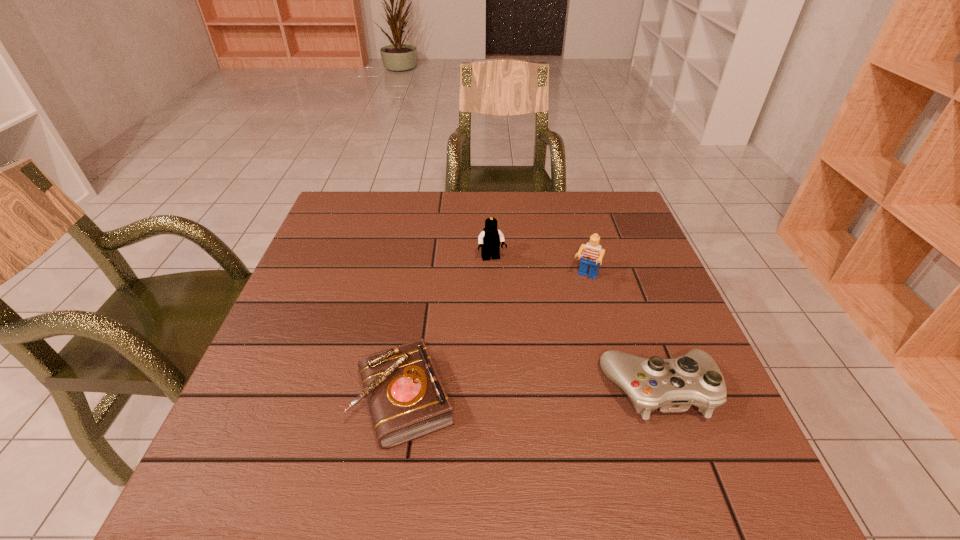
This screenshot has height=540, width=960. In the image, there is a desktop. What are the coordinates of `vacant space at the far edge` in the screenshot? It's located at (530, 211).

At what (x,y) coordinates should I click in order to perform the action: click on blank space at the near edge of the desktop. Please return your answer as a coordinate pair (x, y). The image size is (960, 540). Looking at the image, I should click on (547, 404).

At what (x,y) coordinates should I click in order to perform the action: click on vacant space at the left edge of the desktop. Please return your answer as a coordinate pair (x, y). Image resolution: width=960 pixels, height=540 pixels. Looking at the image, I should click on (322, 266).

In the image, there is a desktop. At what (x,y) coordinates should I click in order to perform the action: click on vacant space at the right edge. Please return your answer as a coordinate pair (x, y). Looking at the image, I should click on (618, 319).

The height and width of the screenshot is (540, 960). In the image, there is a desktop. What are the coordinates of `vacant space at the near left corner` in the screenshot? It's located at (299, 425).

Locate an element on the screen. blank region between the diary and the left Lego is located at coordinates (448, 329).

Locate an element on the screen. The image size is (960, 540). vacant area that lies between the second farthest object and the leftmost object is located at coordinates [495, 339].

Find the location of a particular element. The width and height of the screenshot is (960, 540). free area in between the nearer Lego and the diary is located at coordinates (495, 339).

Where is `free area in between the diary and the third object from right to left`? Image resolution: width=960 pixels, height=540 pixels. free area in between the diary and the third object from right to left is located at coordinates (448, 329).

Find the location of a particular element. vacant space that is in between the control and the diary is located at coordinates (533, 394).